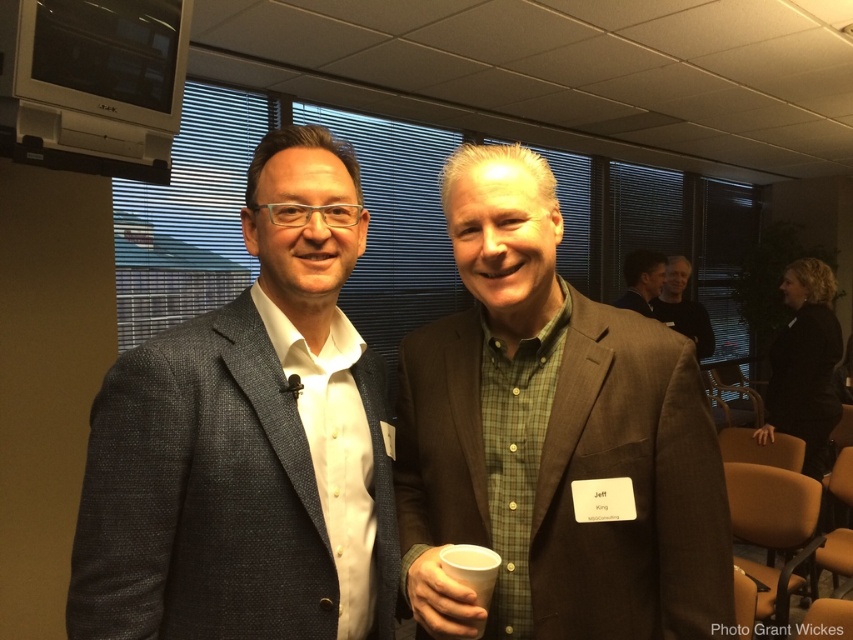
Between black textured blazer at center and dark brown leather jacket at upper right, which one has more height?

With more height is black textured blazer at center.

Is point (830, 291) in front of point (642, 298)?

That is True.

Measure the distance between black textured blazer at center and camera.

They are 3.34 meters apart.

Locate an element on the screen. The height and width of the screenshot is (640, 853). black textured blazer at center is located at coordinates (804, 364).

Which is above, brown textured suit at center or black textured blazer at center?

brown textured suit at center

Is brown textured suit at center thinner than black textured blazer at center?

Yes.

Does point (419, 429) come farther from viewer compared to point (822, 316)?

No, it is in front of (822, 316).

At what (x,y) coordinates should I click in order to perform the action: click on brown textured suit at center. Please return your answer as a coordinate pair (x, y). Looking at the image, I should click on (550, 436).

Which is more to the right, matte gray blazer at left or white paper cup at center?

white paper cup at center

Which is behind, point (335, 554) or point (486, 548)?

The point (335, 554) is more distant.

Find the location of a particular element. The image size is (853, 640). matte gray blazer at left is located at coordinates (248, 442).